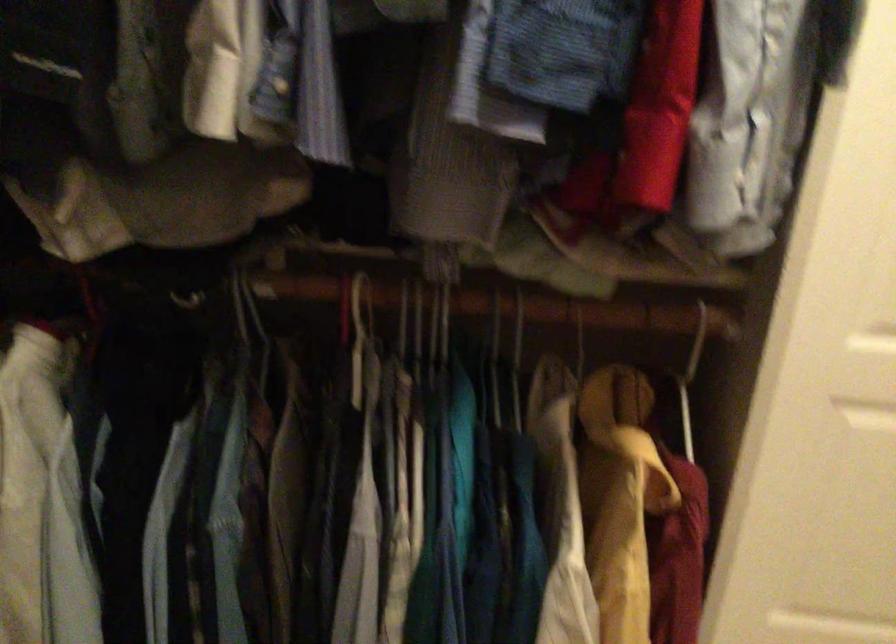
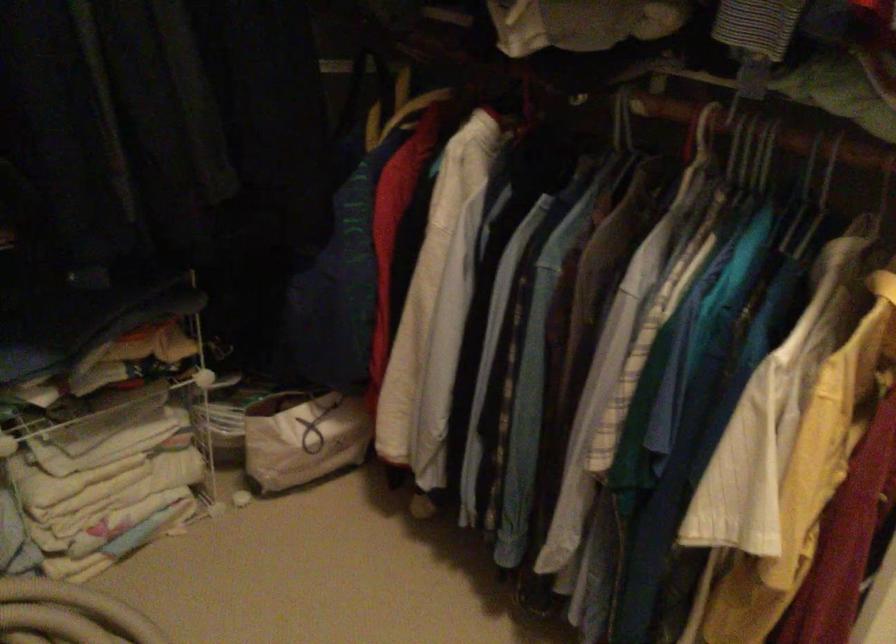
Locate, in the second image, the point that corresponds to (359,308) in the first image.

(702, 134)